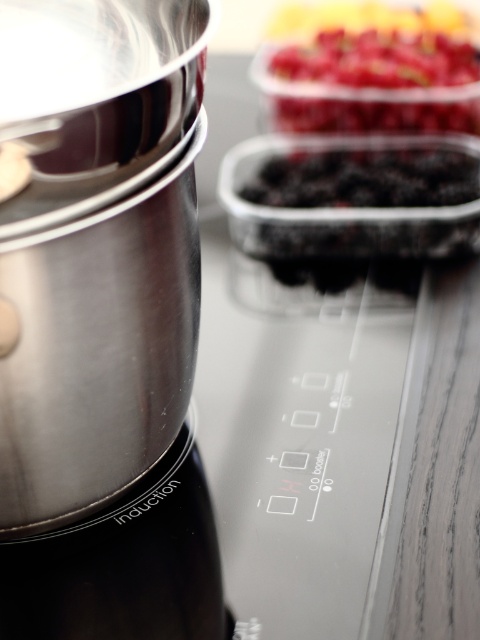
Does polished metal mixer at left have a smaller size compared to glossy plastic berries at upper center?

Incorrect, polished metal mixer at left is not smaller in size than glossy plastic berries at upper center.

Which is more to the left, polished metal mixer at left or glossy plastic berries at upper center?

polished metal mixer at left

At what (x,y) coordinates should I click in order to perform the action: click on polished metal mixer at left. Please return your answer as a coordinate pair (x, y). This screenshot has height=640, width=480. Looking at the image, I should click on (101, 323).